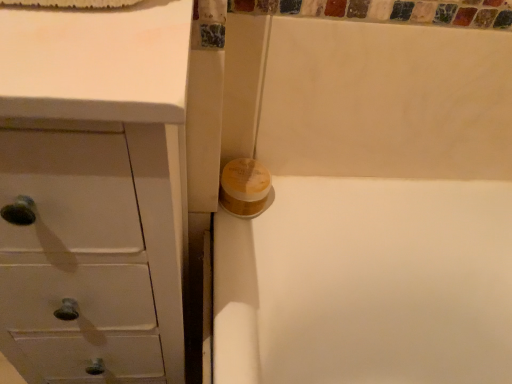
What are the coordinates of `white matte chest of drawers at left` in the screenshot? It's located at (99, 180).

What do you see at coordinates (99, 180) in the screenshot?
I see `white matte chest of drawers at left` at bounding box center [99, 180].

Measure the distance between white matte chest of drawers at left and camera.

The distance of white matte chest of drawers at left from camera is 10.32 inches.

What is the approximate height of white matte chest of drawers at left?

It is 1.01 meters.

Measure the distance between point (255, 198) and camera.

A distance of 30.28 inches exists between point (255, 198) and camera.

Describe the element at coordinates (245, 187) in the screenshot. I see `yellow matte toilet paper at center` at that location.

Locate an element on the screen. This screenshot has width=512, height=384. yellow matte toilet paper at center is located at coordinates (245, 187).

Identify the location of white matte chest of drawers at left. The width and height of the screenshot is (512, 384). (99, 180).

Does white matte chest of drawers at left appear on the left side of yellow matte toilet paper at center?

Correct, you'll find white matte chest of drawers at left to the left of yellow matte toilet paper at center.

Which object is closer to the camera, white matte chest of drawers at left or yellow matte toilet paper at center?

white matte chest of drawers at left is closer to the camera.

Which is behind, point (73, 220) or point (257, 161)?

The point (257, 161) is farther from the camera.

From the image's perspective, would you say white matte chest of drawers at left is shown under yellow matte toilet paper at center?

Yes.

From a real-world perspective, which object rests below the other?

From a 3D spatial view, white matte chest of drawers at left is below.

Is white matte chest of drawers at left thinner than yellow matte toilet paper at center?

No.

Who is taller, white matte chest of drawers at left or yellow matte toilet paper at center?

Standing taller between the two is white matte chest of drawers at left.

Based on their sizes in the image, would you say white matte chest of drawers at left is bigger or smaller than yellow matte toilet paper at center?

Considering their sizes, white matte chest of drawers at left takes up more space than yellow matte toilet paper at center.

Is white matte chest of drawers at left completely or partially outside of yellow matte toilet paper at center?

Yes, white matte chest of drawers at left is outside of yellow matte toilet paper at center.

Is white matte chest of drawers at left far from yellow matte toilet paper at center?

Actually, white matte chest of drawers at left and yellow matte toilet paper at center are a little close together.

From the picture: Is white matte chest of drawers at left oriented away from yellow matte toilet paper at center?

No, white matte chest of drawers at left is not facing the opposite direction of yellow matte toilet paper at center.

How different are the orientations of white matte chest of drawers at left and yellow matte toilet paper at center in degrees?

0.539 degrees separate the facing orientations of white matte chest of drawers at left and yellow matte toilet paper at center.

Measure the distance from white matte chest of drawers at left to yellow matte toilet paper at center.

A distance of 36.40 centimeters exists between white matte chest of drawers at left and yellow matte toilet paper at center.

Find the location of a particular element. toilet paper on the right of the white matte chest of drawers at left is located at coordinates (245, 187).

Does yellow matte toilet paper at center appear on the right side of white matte chest of drawers at left?

Indeed, yellow matte toilet paper at center is positioned on the right side of white matte chest of drawers at left.

Which object is further away from the camera taking this photo, yellow matte toilet paper at center or white matte chest of drawers at left?

yellow matte toilet paper at center is further away from the camera.

Is point (241, 191) closer or farther from the camera than point (183, 183)?

Point (241, 191) is farther from the camera than point (183, 183).

From the image's perspective, which is below, yellow matte toilet paper at center or white matte chest of drawers at left?

white matte chest of drawers at left appears lower in the image.

Looking at this image, from a real-world perspective, who is located higher, yellow matte toilet paper at center or white matte chest of drawers at left?

In real-world perspective, yellow matte toilet paper at center is above.

Which object is thinner, yellow matte toilet paper at center or white matte chest of drawers at left?

With smaller width is yellow matte toilet paper at center.

In the scene shown: Who is taller, yellow matte toilet paper at center or white matte chest of drawers at left?

white matte chest of drawers at left is taller.

Who is smaller, yellow matte toilet paper at center or white matte chest of drawers at left?

Smaller between the two is yellow matte toilet paper at center.

Which is correct: yellow matte toilet paper at center is inside white matte chest of drawers at left, or outside of it?

yellow matte toilet paper at center lies outside white matte chest of drawers at left.

From the picture: Is yellow matte toilet paper at center far from white matte chest of drawers at left?

No, there isn't a large distance between yellow matte toilet paper at center and white matte chest of drawers at left.

Could you tell me if yellow matte toilet paper at center is facing white matte chest of drawers at left?

No, yellow matte toilet paper at center is not turned towards white matte chest of drawers at left.

Measure the distance between yellow matte toilet paper at center and white matte chest of drawers at left.

yellow matte toilet paper at center and white matte chest of drawers at left are 14.33 inches apart.

In order to click on the chest of drawers in front of the yellow matte toilet paper at center in this screenshot , I will do `click(99, 180)`.

Identify the location of toilet paper lying above the white matte chest of drawers at left (from the image's perspective). (245, 187).

Locate an element on the screen. The width and height of the screenshot is (512, 384). toilet paper behind the white matte chest of drawers at left is located at coordinates (245, 187).